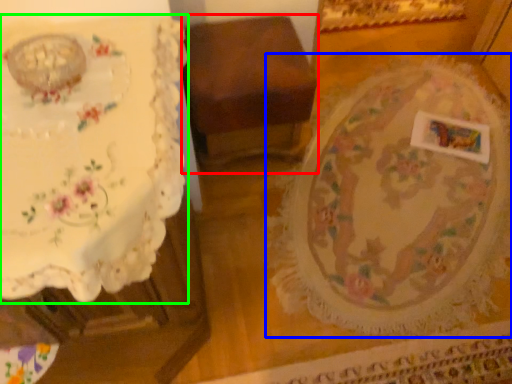
Question: Which object is the farthest from furniture (highlighted by a red box)? Choose among these: round table (highlighted by a blue box) or table (highlighted by a green box).

Choices:
 (A) round table
 (B) table

Answer: (B)